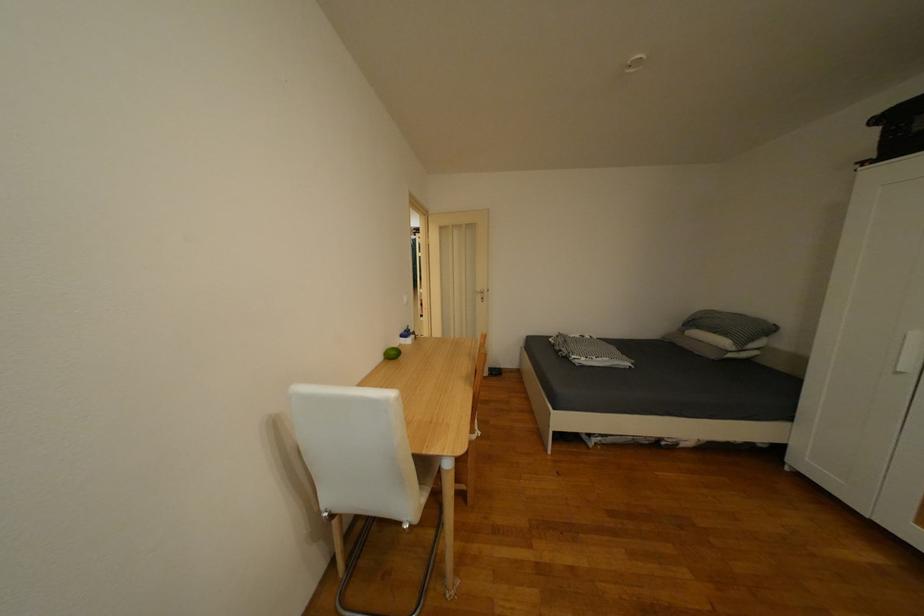
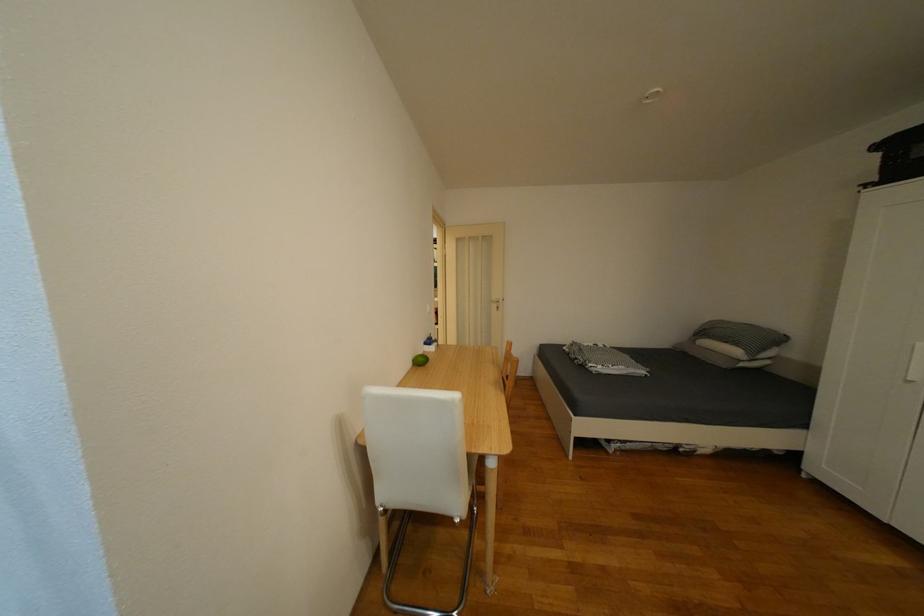
Where in the second image is the point corresponding to (691,326) from the first image?

(702, 337)